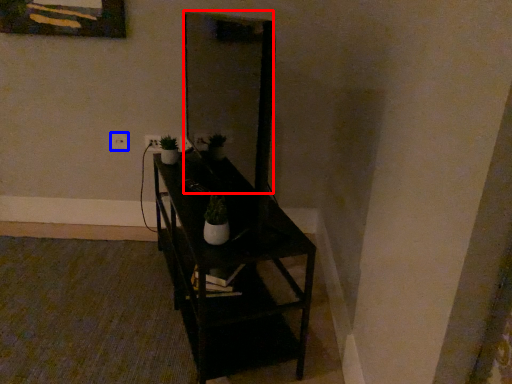
Question: Among these objects, which one is nearest to the camera, mirror (highlighted by a red box) or electric outlet (highlighted by a blue box)?

Choices:
 (A) mirror
 (B) electric outlet

Answer: (A)